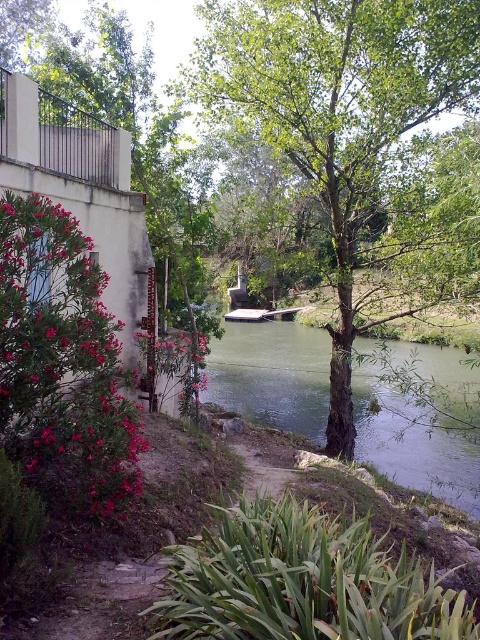
Who is more forward, (75, 97) or (8, 291)?

Point (8, 291) is in front.

Which is behind, point (189, 224) or point (87, 497)?

Point (189, 224)

Image resolution: width=480 pixels, height=640 pixels. What are the coordinates of `green leafy tree at upper center` in the screenshot? It's located at (110, 180).

Measure the distance between green leafy tree at center and green leafy tree at upper center.

A distance of 12.72 feet exists between green leafy tree at center and green leafy tree at upper center.

Is green leafy tree at center to the right of green leafy tree at upper center from the viewer's perspective?

Indeed, green leafy tree at center is positioned on the right side of green leafy tree at upper center.

The width and height of the screenshot is (480, 640). Find the location of `green leafy tree at center`. green leafy tree at center is located at coordinates (336, 108).

Does matte pink flowers at left have a smaller size compared to green smooth water at center?

Yes, matte pink flowers at left is smaller than green smooth water at center.

From the picture: Between matte pink flowers at left and green smooth water at center, which one is positioned higher?

matte pink flowers at left is above.

The height and width of the screenshot is (640, 480). I want to click on matte pink flowers at left, so (61, 364).

Identify the location of matte pink flowers at left. (61, 364).